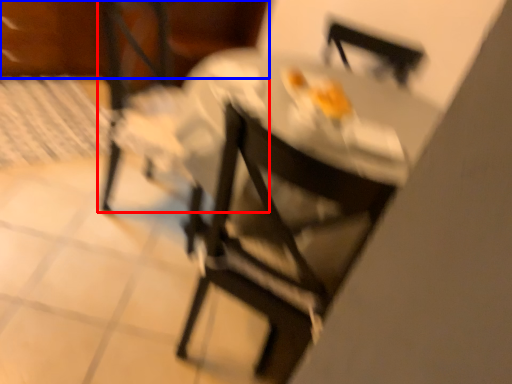
Question: Among these objects, which one is nearest to the camera, chair (highlighted by a red box) or leftover (highlighted by a blue box)?

Choices:
 (A) chair
 (B) leftover

Answer: (A)